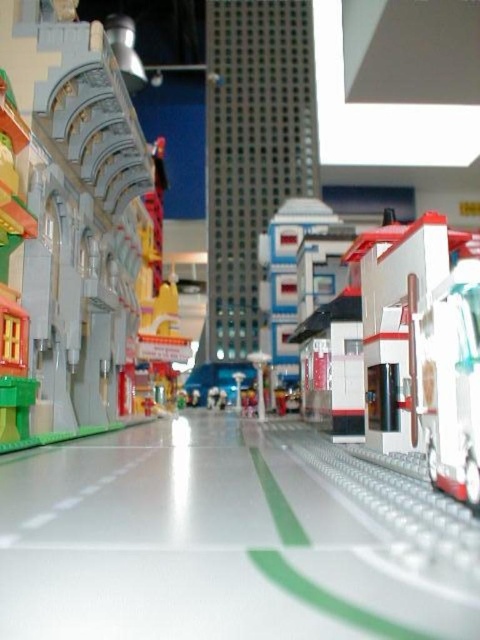
You are standing in the Lego cityscape and want to move from the point at coordinates (x=105, y=397) to the point at coordinates (x=439, y=324). Which direction should you face to walk towards the second point?

You should face away from the viewer because point (x=105, y=397) is closer to you than point (x=439, y=324), so you need to move away from your current position towards it.